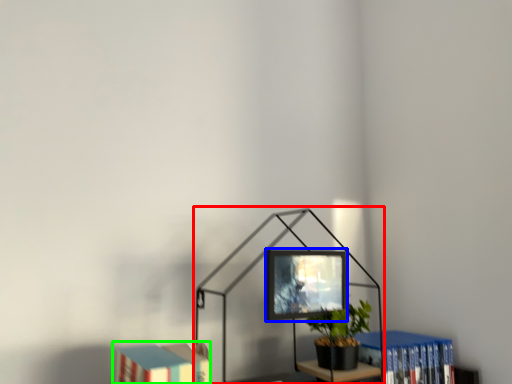
Question: Estimate the real-world distances between objects in this image. Which object is farther from table lamp (highlighted by a red box), computer monitor (highlighted by a blue box) or book (highlighted by a green box)?

Choices:
 (A) computer monitor
 (B) book

Answer: (B)